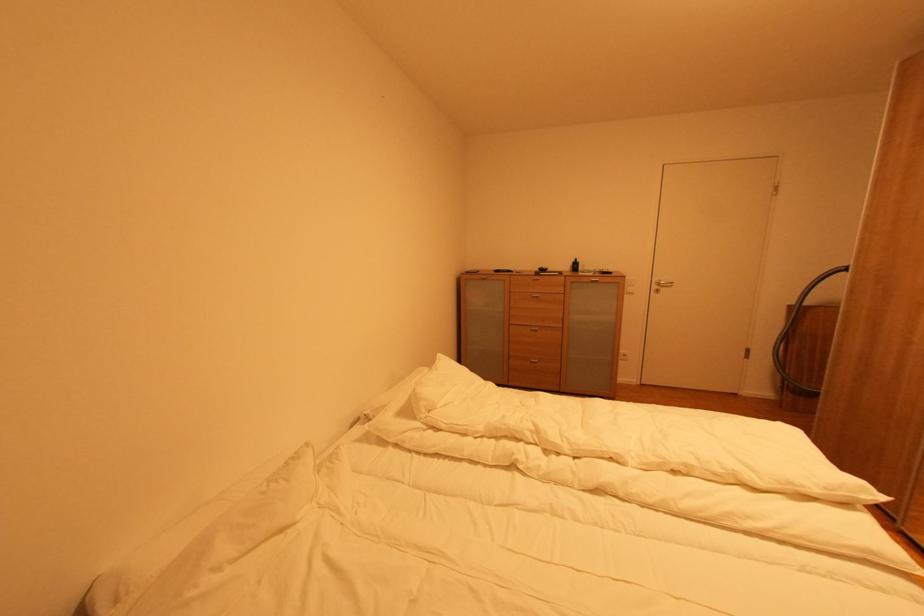
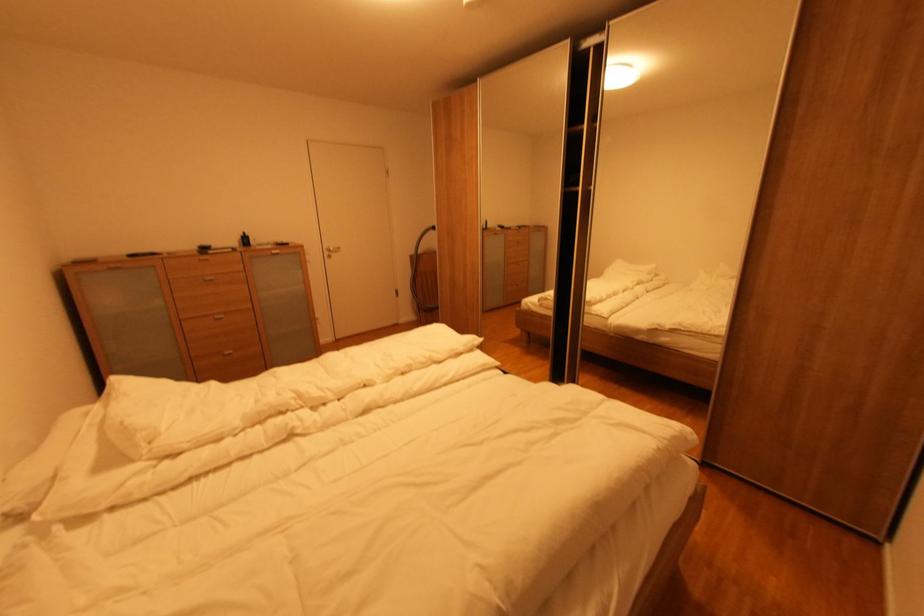
Find the pixel in the second image that matches the point at 661,289 in the first image.

(333, 254)